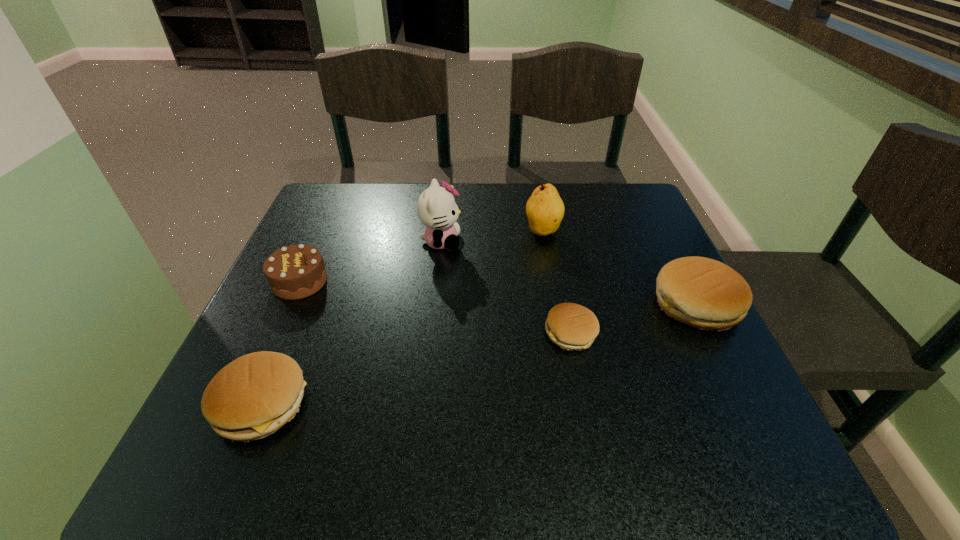
Image resolution: width=960 pixels, height=540 pixels. I want to click on vacant region located 0.090m on the right of the shortest object, so click(644, 333).

This screenshot has height=540, width=960. In order to click on vacant space situated 0.380m on the back of the rightmost object in this screenshot , I will do `click(636, 187)`.

The height and width of the screenshot is (540, 960). What are the coordinates of `free space located on the right of the fifth shortest object` in the screenshot? It's located at (617, 231).

Identify the location of vacant space located on the front-facing side of the kitten. This screenshot has width=960, height=540. (579, 241).

In order to click on free region located 0.250m on the front of the chocolate cake in this screenshot , I will do `click(243, 408)`.

Where is `pear that is at the far edge`? Image resolution: width=960 pixels, height=540 pixels. pear that is at the far edge is located at coordinates (545, 209).

Locate an element on the screen. This screenshot has width=960, height=540. kitten that is at the far edge is located at coordinates (436, 207).

Locate an element on the screen. This screenshot has height=540, width=960. object present at the near edge is located at coordinates (253, 396).

The width and height of the screenshot is (960, 540). Find the location of `patty present at the left edge`. patty present at the left edge is located at coordinates (253, 396).

Locate an element on the screen. Image resolution: width=960 pixels, height=540 pixels. chocolate cake present at the left edge is located at coordinates (294, 272).